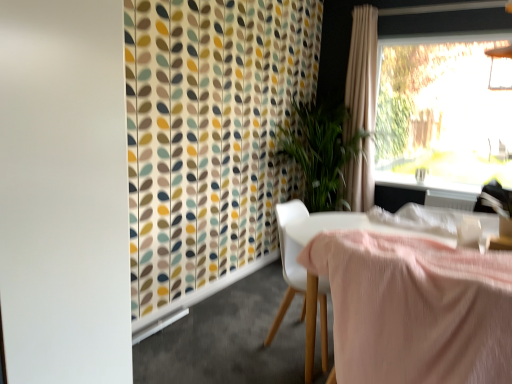
Question: Is white glossy window sill at upper right closer to camera compared to beige fabric curtain at upper right?

Choices:
 (A) no
 (B) yes

Answer: (A)

Question: Is white glossy window sill at upper right placed right next to beige fabric curtain at upper right?

Choices:
 (A) no
 (B) yes

Answer: (A)

Question: Is white glossy window sill at upper right smaller than beige fabric curtain at upper right?

Choices:
 (A) no
 (B) yes

Answer: (B)

Question: Is white glossy window sill at upper right looking in the opposite direction of beige fabric curtain at upper right?

Choices:
 (A) yes
 (B) no

Answer: (B)

Question: Does white glossy window sill at upper right have a greater height compared to beige fabric curtain at upper right?

Choices:
 (A) no
 (B) yes

Answer: (A)

Question: Are white glossy window sill at upper right and beige fabric curtain at upper right far apart?

Choices:
 (A) no
 (B) yes

Answer: (B)

Question: Are white glossy window sill at upper right and white plastic chair at center making contact?

Choices:
 (A) no
 (B) yes

Answer: (A)

Question: Does white glossy window sill at upper right lie behind white plastic chair at center?

Choices:
 (A) no
 (B) yes

Answer: (B)

Question: Considering the relative sizes of white glossy window sill at upper right and white plastic chair at center in the image provided, is white glossy window sill at upper right bigger than white plastic chair at center?

Choices:
 (A) yes
 (B) no

Answer: (B)

Question: Is white glossy window sill at upper right in front of white plastic chair at center?

Choices:
 (A) no
 (B) yes

Answer: (A)

Question: From a real-world perspective, is white glossy window sill at upper right physically above white plastic chair at center?

Choices:
 (A) no
 (B) yes

Answer: (B)

Question: Does white glossy window sill at upper right have a lesser height compared to white plastic chair at center?

Choices:
 (A) yes
 (B) no

Answer: (A)

Question: Is white plastic chair at center in contact with pink fabric-covered table at center?

Choices:
 (A) yes
 (B) no

Answer: (B)